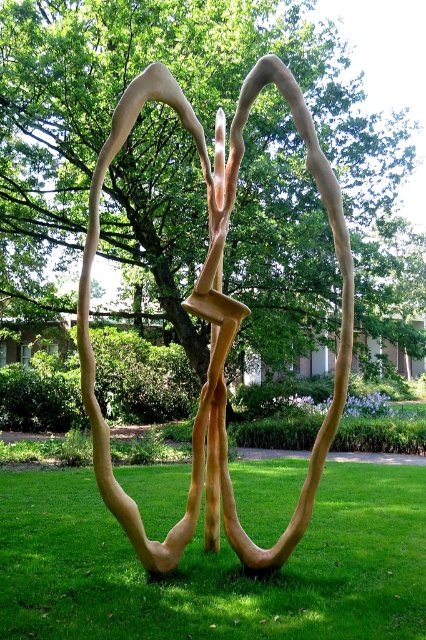
In the scene shown: You are standing in front of the sculpture and want to touch both points on it. Which point should you reach for first, the one at coordinate point (261,19) or the one at coordinate point (126,500)?

You should reach for point (261,19) first because it is closer to you than point (126,500), which is further away from the camera.

You are standing on the green grass at center and see the point marked at coordinates [215,566]. Is this point located on the sculpture or on the grass?

The point at coordinates [215,566] is on the green grass at center, so it is located on the grass.